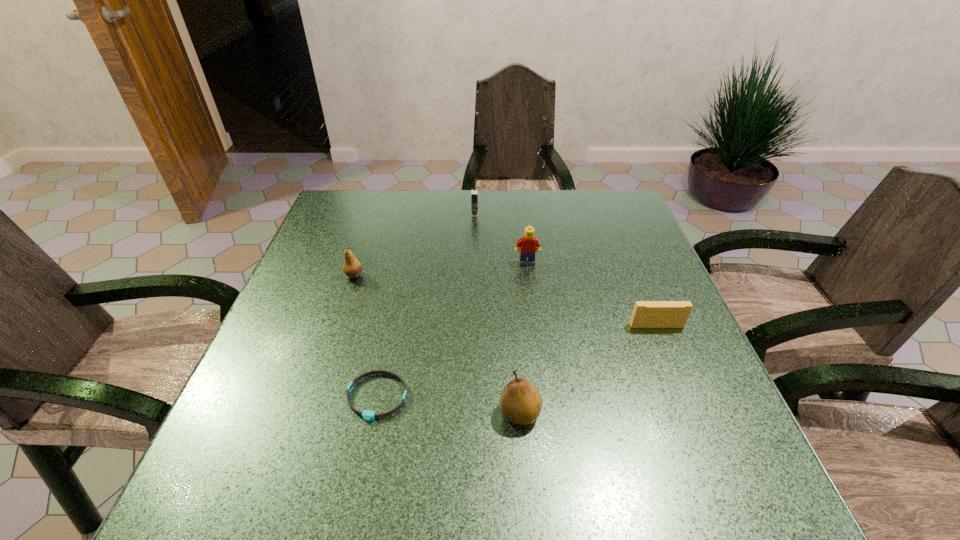
The width and height of the screenshot is (960, 540). I want to click on blank space located 0.370m on the front-facing side of the farthest object, so click(x=473, y=306).

Find the location of a particular element. The width and height of the screenshot is (960, 540). vacant space located on the front-facing side of the Lego is located at coordinates (536, 332).

Where is `vacant space located 0.290m on the back of the farther pear`? This screenshot has height=540, width=960. vacant space located 0.290m on the back of the farther pear is located at coordinates (376, 208).

Where is `vacant space located 0.220m on the right of the nearer pear`? The height and width of the screenshot is (540, 960). vacant space located 0.220m on the right of the nearer pear is located at coordinates (660, 413).

The image size is (960, 540). Identify the location of vacant space situated at the front of the fourth farthest object with spools. (684, 395).

Locate an element on the screen. The image size is (960, 540). object that is at the far edge is located at coordinates (474, 192).

Find the location of a particular element. The height and width of the screenshot is (540, 960). object that is at the left edge is located at coordinates (352, 268).

The height and width of the screenshot is (540, 960). What are the coordinates of `object present at the right edge` in the screenshot? It's located at (646, 314).

In the image, there is a desktop. At what (x,y) coordinates should I click in order to perform the action: click on free space at the far edge. Please return your answer as a coordinate pair (x, y). The image size is (960, 540). Looking at the image, I should click on (452, 219).

Where is `free location at the near edge of the desktop`? This screenshot has width=960, height=540. free location at the near edge of the desktop is located at coordinates (629, 460).